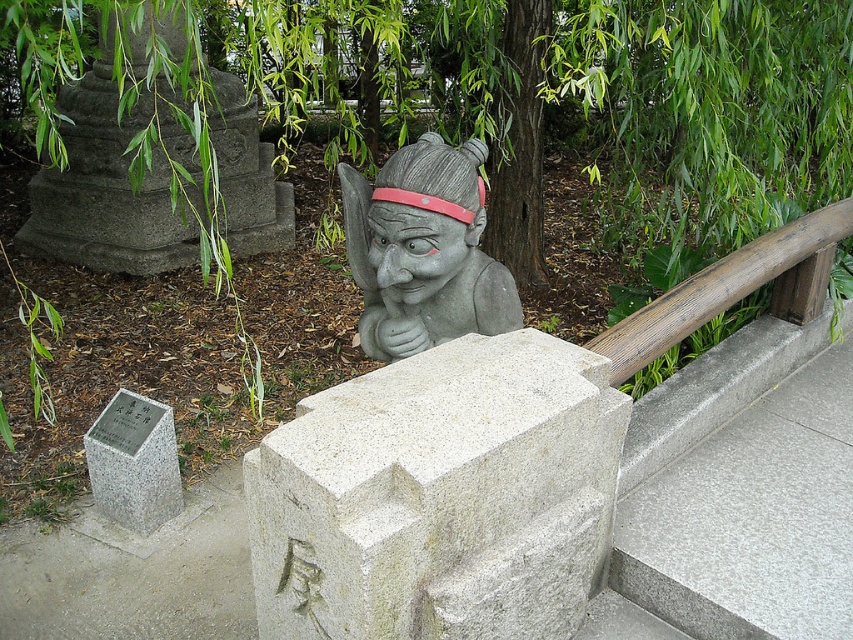
You are a visitor in the park and want to take a photo of the gray stone statue at center without any obstruction. Is the green leafy tree at upper center blocking the statue?

The green leafy tree at upper center is taller than the gray stone statue at center, so it may block the statue when taking a photo from below. Move to a higher position or angle your camera upwards to avoid the tree.

You are a visitor at the park and want to take a photo of the gray stone statue at center and the gray granite marker at lower left. Which object should you focus on first if you want to capture both in one frame without moving the camera?

The gray stone statue at center is above the gray granite marker at lower left, so you should focus on the gray granite marker at lower left first as it is lower and closer to the base of the frame to include both in one shot.

You are a visitor in the park and want to take a photo of the gray stone statue at center. However, there is a green leafy tree at upper center in the way. Can you see the statue clearly from your current position?

The gray stone statue at center is behind the green leafy tree at upper center, so you cannot see the statue clearly from your current position. Move to a different angle to get a clear view.